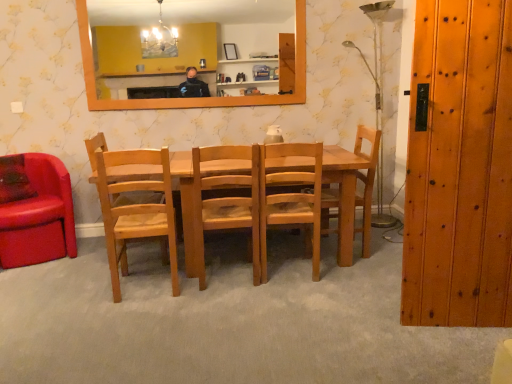
Where is `vacant area situated below wooden chair at center, the third chair in the left-to-right sequence (from a real-world perspective)`? vacant area situated below wooden chair at center, the third chair in the left-to-right sequence (from a real-world perspective) is located at coordinates (227, 271).